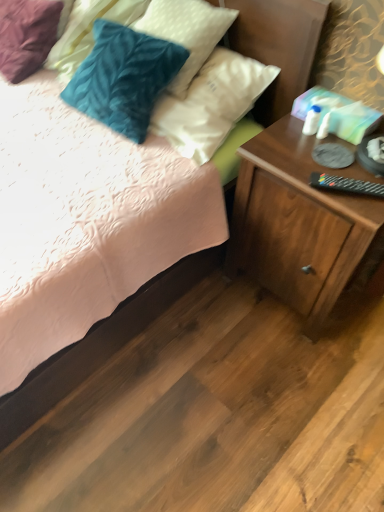
Question: Is wooden nightstand at lower right positioned with its back to black plastic remote control at right?

Choices:
 (A) no
 (B) yes

Answer: (A)

Question: Can you confirm if wooden nightstand at lower right is thinner than black plastic remote control at right?

Choices:
 (A) yes
 (B) no

Answer: (B)

Question: From the image's perspective, would you say wooden nightstand at lower right is shown under black plastic remote control at right?

Choices:
 (A) no
 (B) yes

Answer: (B)

Question: Does wooden nightstand at lower right have a greater height compared to black plastic remote control at right?

Choices:
 (A) yes
 (B) no

Answer: (A)

Question: Does wooden nightstand at lower right have a larger size compared to black plastic remote control at right?

Choices:
 (A) no
 (B) yes

Answer: (B)

Question: Choose the correct answer: Is velvety teal pillow at upper left, the 2th pillow viewed from the right, inside black plastic remote control at right or outside it?

Choices:
 (A) outside
 (B) inside

Answer: (A)

Question: In terms of size, does velvety teal pillow at upper left, the first pillow in the left-to-right sequence, appear bigger or smaller than black plastic remote control at right?

Choices:
 (A) big
 (B) small

Answer: (A)

Question: In terms of width, does velvety teal pillow at upper left, the 2th pillow viewed from the right, look wider or thinner when compared to black plastic remote control at right?

Choices:
 (A) wide
 (B) thin

Answer: (A)

Question: Is point (x=87, y=38) closer or farther from the camera than point (x=312, y=185)?

Choices:
 (A) closer
 (B) farther

Answer: (B)

Question: Considering the positions of point (228, 9) and point (86, 32), is point (228, 9) closer or farther from the camera than point (86, 32)?

Choices:
 (A) farther
 (B) closer

Answer: (B)

Question: From the image's perspective, is velvety blue pillow at upper left, which is the first pillow in right-to-left order, located above or below velvety teal pillow at upper left, the first pillow in the left-to-right sequence?

Choices:
 (A) below
 (B) above

Answer: (A)

Question: Considering their positions, is velvety blue pillow at upper left, which is the first pillow in right-to-left order, located in front of or behind velvety teal pillow at upper left, the 2th pillow viewed from the right?

Choices:
 (A) front
 (B) behind

Answer: (A)

Question: In terms of width, does velvety blue pillow at upper left, which is the first pillow in right-to-left order, look wider or thinner when compared to velvety teal pillow at upper left, the first pillow in the left-to-right sequence?

Choices:
 (A) wide
 (B) thin

Answer: (B)

Question: From a real-world perspective, is velvety teal pillow at upper left, the 2th pillow viewed from the right, physically located above or below wooden nightstand at lower right?

Choices:
 (A) above
 (B) below

Answer: (A)

Question: From the image's perspective, is velvety teal pillow at upper left, the first pillow in the left-to-right sequence, above or below wooden nightstand at lower right?

Choices:
 (A) below
 (B) above

Answer: (B)